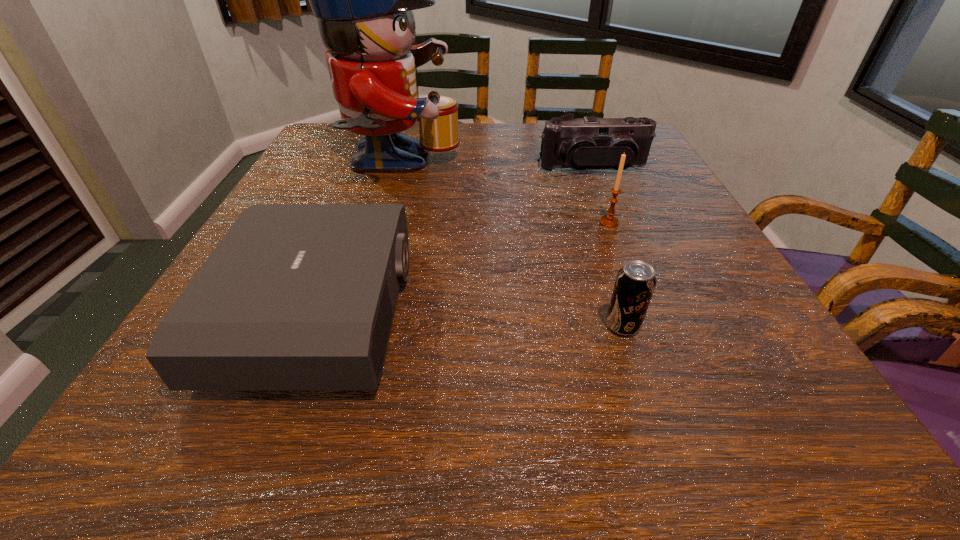
The height and width of the screenshot is (540, 960). What are the coordinates of `free space located on the front-facing side of the projector` in the screenshot? It's located at (480, 312).

The width and height of the screenshot is (960, 540). I want to click on nutcracker that is at the far edge, so click(363, 0).

Image resolution: width=960 pixels, height=540 pixels. I want to click on camcorder that is at the far edge, so click(x=584, y=143).

You are a GUI agent. You are given a task and a screenshot of the screen. Output one action in this format:
    pyautogui.click(x=<x>, y=<y>)
    Task: Click on the object that is at the near edge
    The height and width of the screenshot is (540, 960).
    Given the screenshot: What is the action you would take?
    pyautogui.click(x=295, y=296)

At what (x,y) coordinates should I click in order to perform the action: click on nutcracker positioned at the left edge. Please return your answer as a coordinate pair (x, y). The image size is (960, 540). Looking at the image, I should click on (363, 0).

Locate an element on the screen. The width and height of the screenshot is (960, 540). projector that is at the left edge is located at coordinates coord(295,296).

At what (x,y) coordinates should I click in order to perform the action: click on candle_holder at the right edge. Please return your answer as a coordinate pair (x, y). The height and width of the screenshot is (540, 960). Looking at the image, I should click on (609, 220).

Image resolution: width=960 pixels, height=540 pixels. What are the coordinates of `camcorder that is at the right edge` in the screenshot? It's located at (584, 143).

At what (x,y) coordinates should I click in order to perform the action: click on object at the far left corner. Please return your answer as a coordinate pair (x, y). The height and width of the screenshot is (540, 960). Looking at the image, I should click on (363, 0).

Find the location of a particular element. object situated at the near left corner is located at coordinates (295, 296).